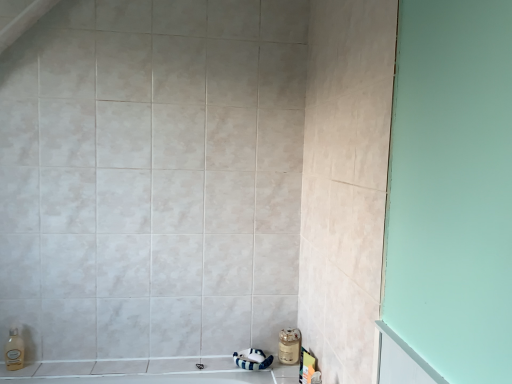
This screenshot has width=512, height=384. I want to click on metallic gold jar at lower right, so click(289, 346).

Describe the element at coordinates (289, 346) in the screenshot. I see `metallic gold jar at lower right` at that location.

What do you see at coordinates (14, 351) in the screenshot?
I see `translucent plastic soap dispenser at lower left` at bounding box center [14, 351].

Locate an element on the screen. translucent plastic soap dispenser at lower left is located at coordinates (14, 351).

Locate an element on the screen. The height and width of the screenshot is (384, 512). metallic gold jar at lower right is located at coordinates (289, 346).

Considering the relative positions of metallic gold jar at lower right and translucent plastic soap dispenser at lower left in the image provided, is metallic gold jar at lower right to the left of translucent plastic soap dispenser at lower left from the viewer's perspective?

Incorrect, metallic gold jar at lower right is not on the left side of translucent plastic soap dispenser at lower left.

Between metallic gold jar at lower right and translucent plastic soap dispenser at lower left, which one is positioned behind?

Positioned behind is metallic gold jar at lower right.

Is point (297, 353) positioned before point (22, 358)?

No, it is not.

From the image's perspective, which object appears higher, metallic gold jar at lower right or translucent plastic soap dispenser at lower left?

translucent plastic soap dispenser at lower left.

From a real-world perspective, relative to translucent plastic soap dispenser at lower left, is metallic gold jar at lower right vertically above or below?

Clearly, from a real-world perspective, metallic gold jar at lower right is below translucent plastic soap dispenser at lower left.

Considering the relative sizes of metallic gold jar at lower right and translucent plastic soap dispenser at lower left in the image provided, is metallic gold jar at lower right wider than translucent plastic soap dispenser at lower left?

Yes, metallic gold jar at lower right is wider than translucent plastic soap dispenser at lower left.

Who is shorter, metallic gold jar at lower right or translucent plastic soap dispenser at lower left?

metallic gold jar at lower right.

Can you confirm if metallic gold jar at lower right is bigger than translucent plastic soap dispenser at lower left?

Yes.

Is metallic gold jar at lower right not within translucent plastic soap dispenser at lower left?

Yes, metallic gold jar at lower right is located beyond the bounds of translucent plastic soap dispenser at lower left.

Would you consider metallic gold jar at lower right to be distant from translucent plastic soap dispenser at lower left?

Yes, metallic gold jar at lower right and translucent plastic soap dispenser at lower left are located far from each other.

In the scene shown: Could you tell me if metallic gold jar at lower right is facing translucent plastic soap dispenser at lower left?

No, metallic gold jar at lower right is not turned towards translucent plastic soap dispenser at lower left.

How different are the orientations of metallic gold jar at lower right and translucent plastic soap dispenser at lower left in degrees?

The facing directions of metallic gold jar at lower right and translucent plastic soap dispenser at lower left are 1.07 degrees apart.

In the image, there is a translucent plastic soap dispenser at lower left. At what (x,y) coordinates should I click in order to perform the action: click on toiletry below it (from a real-world perspective). Please return your answer as a coordinate pair (x, y). Looking at the image, I should click on (289, 346).

Considering the relative positions of translucent plastic soap dispenser at lower left and metallic gold jar at lower right in the image provided, is translucent plastic soap dispenser at lower left to the left or to the right of metallic gold jar at lower right?

translucent plastic soap dispenser at lower left is positioned on metallic gold jar at lower right's left side.

Between translucent plastic soap dispenser at lower left and metallic gold jar at lower right, which one is positioned behind?

metallic gold jar at lower right.

Which is closer to the camera, (10,362) or (283,351)?

Clearly, point (10,362) is closer to the camera than point (283,351).

From the image's perspective, would you say translucent plastic soap dispenser at lower left is positioned over metallic gold jar at lower right?

Yes, from the image's perspective, translucent plastic soap dispenser at lower left is above metallic gold jar at lower right.

From a real-world perspective, who is located higher, translucent plastic soap dispenser at lower left or metallic gold jar at lower right?

translucent plastic soap dispenser at lower left, from a real-world perspective.

Looking at their sizes, would you say translucent plastic soap dispenser at lower left is wider or thinner than metallic gold jar at lower right?

Considering their sizes, translucent plastic soap dispenser at lower left looks slimmer than metallic gold jar at lower right.

Which of these two, translucent plastic soap dispenser at lower left or metallic gold jar at lower right, stands shorter?

Standing shorter between the two is metallic gold jar at lower right.

Between translucent plastic soap dispenser at lower left and metallic gold jar at lower right, which one has larger size?

metallic gold jar at lower right.

Is translucent plastic soap dispenser at lower left located outside metallic gold jar at lower right?

That's correct, translucent plastic soap dispenser at lower left is outside of metallic gold jar at lower right.

Can you see translucent plastic soap dispenser at lower left touching metallic gold jar at lower right?

translucent plastic soap dispenser at lower left and metallic gold jar at lower right are not in contact.

Is translucent plastic soap dispenser at lower left turned away from metallic gold jar at lower right?

No, translucent plastic soap dispenser at lower left is not facing away from metallic gold jar at lower right.

Based on the photo, how different are the orientations of translucent plastic soap dispenser at lower left and metallic gold jar at lower right in degrees?

The facing directions of translucent plastic soap dispenser at lower left and metallic gold jar at lower right are 1.07 degrees apart.

Image resolution: width=512 pixels, height=384 pixels. I want to click on toiletry located underneath the translucent plastic soap dispenser at lower left (from a real-world perspective), so click(289, 346).

Where is `soap dispenser located above the metallic gold jar at lower right (from the image's perspective)`? The height and width of the screenshot is (384, 512). soap dispenser located above the metallic gold jar at lower right (from the image's perspective) is located at coordinates (14, 351).

Where is `toiletry below the translucent plastic soap dispenser at lower left (from a real-world perspective)`? The image size is (512, 384). toiletry below the translucent plastic soap dispenser at lower left (from a real-world perspective) is located at coordinates (289, 346).